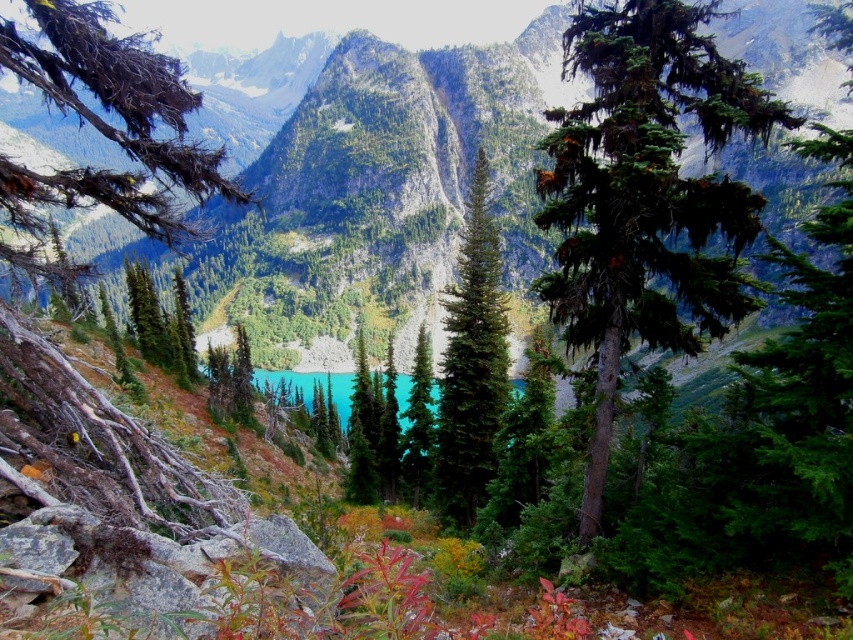
Image resolution: width=853 pixels, height=640 pixels. Describe the element at coordinates (381, 193) in the screenshot. I see `green textured mountain at center` at that location.

Which is more to the left, green textured mountain at center or green glossy tree at center?

green textured mountain at center

Between point (759, 68) and point (421, 419), which one is positioned in front?

Positioned in front is point (421, 419).

Image resolution: width=853 pixels, height=640 pixels. Identify the location of green textured mountain at center. (381, 193).

Can you confirm if green matte evergreen tree at center is smaller than green glossy tree at center?

Incorrect, green matte evergreen tree at center is not smaller in size than green glossy tree at center.

Find the location of a particular element. The width and height of the screenshot is (853, 640). green matte evergreen tree at center is located at coordinates (471, 364).

Image resolution: width=853 pixels, height=640 pixels. Identify the location of green matte evergreen tree at center. (471, 364).

Can you confirm if brown textured branch at upper left is taller than green glossy tree at center?

Yes.

Between brown textured branch at upper left and green glossy tree at center, which one has more height?

brown textured branch at upper left is taller.

Is point (112, 173) farther from camera compared to point (415, 397)?

No.

Where is `brown textured branch at upper left`? The width and height of the screenshot is (853, 640). brown textured branch at upper left is located at coordinates (103, 132).